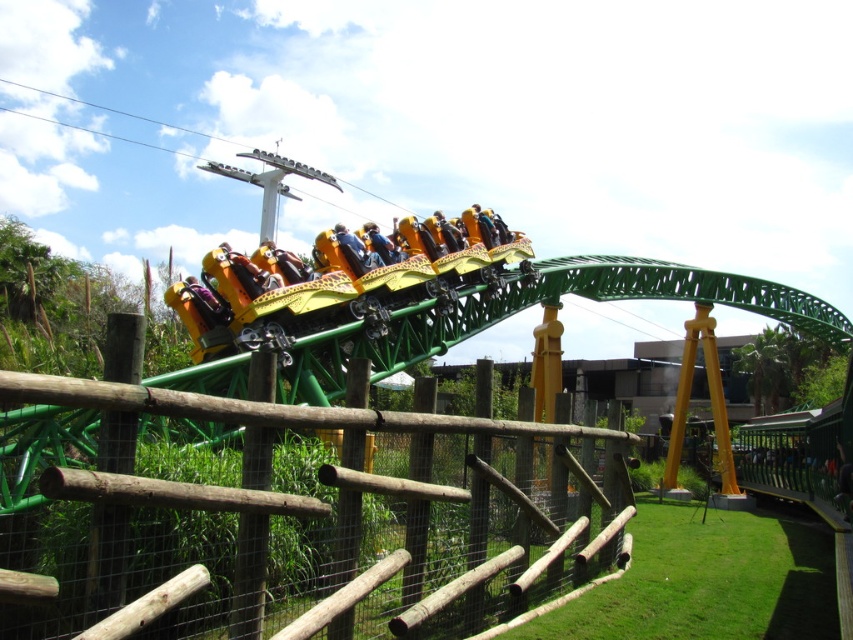
Question: Which of the following is the farthest from the observer?

Choices:
 (A) (260, 451)
 (B) (351, 237)

Answer: (B)

Question: Does wooden at center appear over yellow leopard print seats at center?

Choices:
 (A) yes
 (B) no

Answer: (B)

Question: Does wooden at center appear under yellow leopard print seats at center?

Choices:
 (A) no
 (B) yes

Answer: (B)

Question: Which object is closer to the camera taking this photo?

Choices:
 (A) wooden at center
 (B) yellow leopard print seats at center

Answer: (A)

Question: Considering the relative positions of wooden at center and yellow leopard print seats at center in the image provided, where is wooden at center located with respect to yellow leopard print seats at center?

Choices:
 (A) left
 (B) right

Answer: (B)